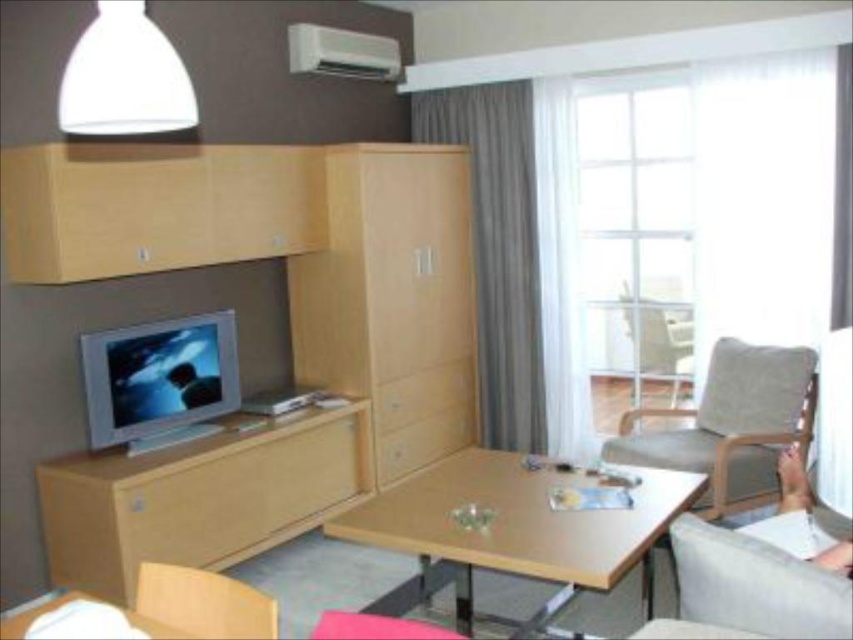
Question: Which point is farther to the camera?

Choices:
 (A) light gray fabric armchair at center
 (B) white fabric couch at lower right

Answer: (A)

Question: Does white fabric couch at lower right have a larger size compared to wooden table at lower center?

Choices:
 (A) yes
 (B) no

Answer: (A)

Question: Considering the relative positions of wooden table at center and light brown fabric armchair at right in the image provided, where is wooden table at center located with respect to light brown fabric armchair at right?

Choices:
 (A) right
 (B) left

Answer: (B)

Question: Which point is closer to the camera taking this photo?

Choices:
 (A) (247, 616)
 (B) (479, 563)
 (C) (152, 68)
 (D) (761, 477)

Answer: (C)

Question: Is wooden table at center above white matte lampshade at upper center?

Choices:
 (A) no
 (B) yes

Answer: (A)

Question: Which object is the farthest from the white matte lampshade at upper center?

Choices:
 (A) white fabric couch at lower right
 (B) wooden table at lower center

Answer: (A)